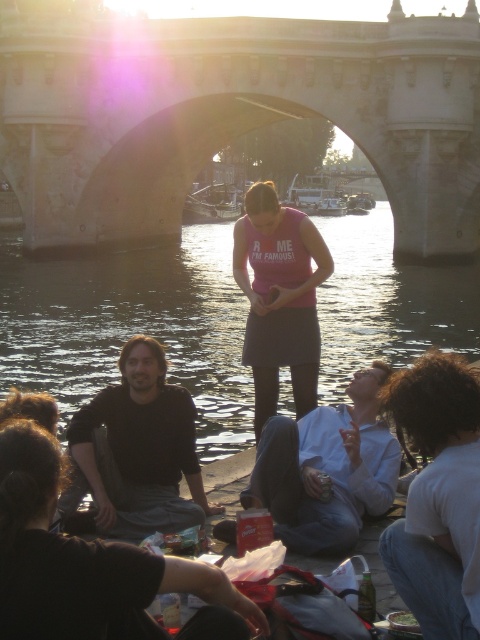
Is point (9, 349) farther from viewer compared to point (325, 266)?

Yes, it is.

Between dark water at center and pink matte skirt at center, which one has less height?

With less height is pink matte skirt at center.

The width and height of the screenshot is (480, 640). What do you see at coordinates (132, 326) in the screenshot?
I see `dark water at center` at bounding box center [132, 326].

You are a GUI agent. You are given a task and a screenshot of the screen. Output one action in this format:
    pyautogui.click(x=<x>, y=<y>)
    Task: Click on the dark water at center
    
    Given the screenshot: What is the action you would take?
    pyautogui.click(x=132, y=326)

Does stone bridge at center have a lesser height compared to pink matte skirt at center?

Incorrect, stone bridge at center's height does not fall short of pink matte skirt at center's.

What do you see at coordinates (230, 115) in the screenshot? The width and height of the screenshot is (480, 640). I see `stone bridge at center` at bounding box center [230, 115].

Where is `stone bridge at center`? The height and width of the screenshot is (640, 480). stone bridge at center is located at coordinates (230, 115).

Can you confirm if stone bridge at center is wider than dark water at center?

No.

Identify the location of stone bridge at center. [x=230, y=115].